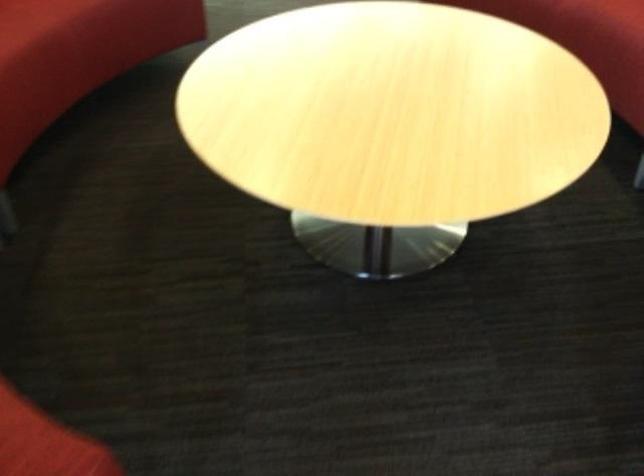
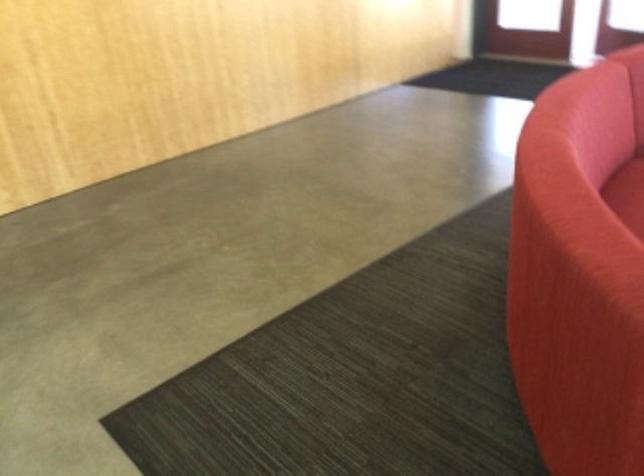
The images are taken continuously from a first-person perspective. In which direction is your viewpoint rotating?

The rotation direction of the camera is right-down.